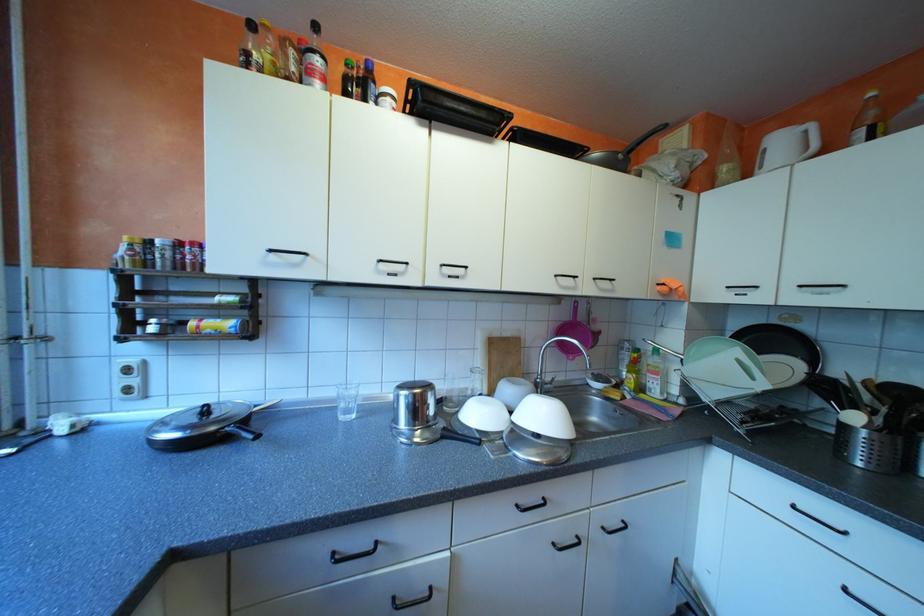
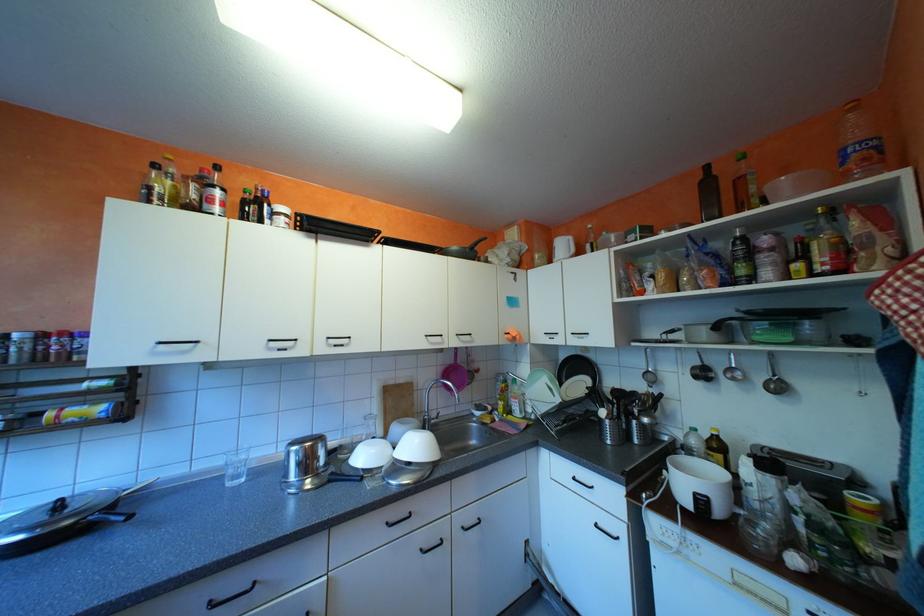
In the second image, find the point that corresponds to point (565, 543) in the first image.

(432, 549)